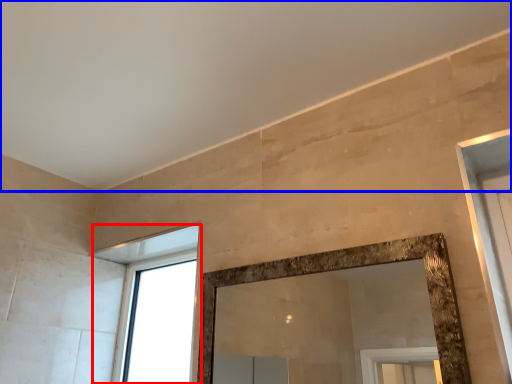
Question: Which point is further to the camera, window (highlighted by a red box) or backdrop (highlighted by a blue box)?

Choices:
 (A) window
 (B) backdrop

Answer: (A)